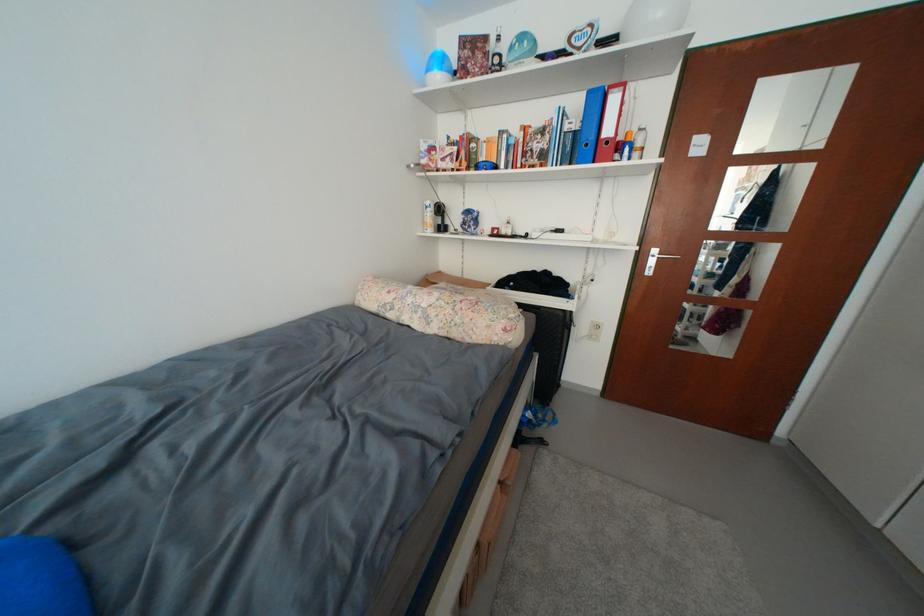
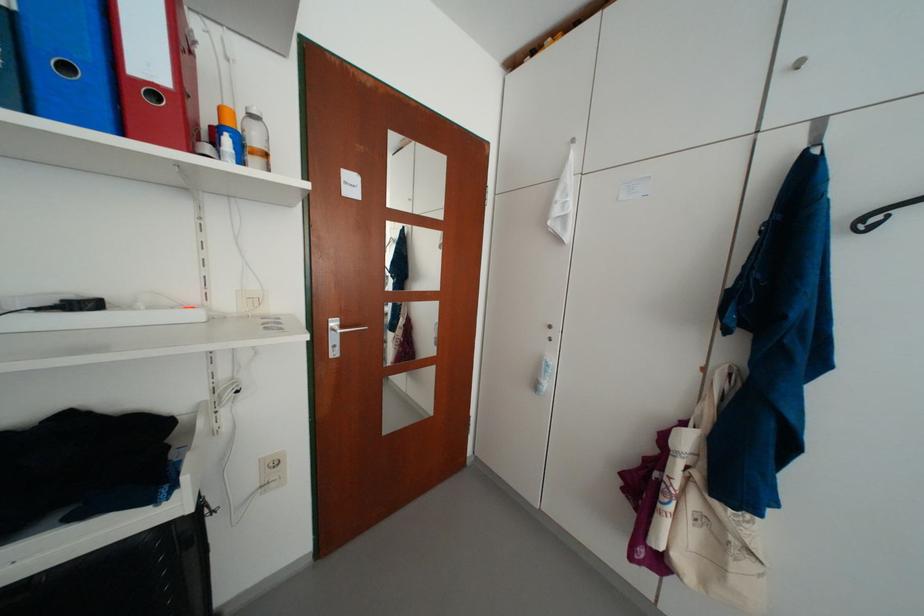
In the second image, find the point that corresponds to point 594,148 in the first image.

(76, 70)